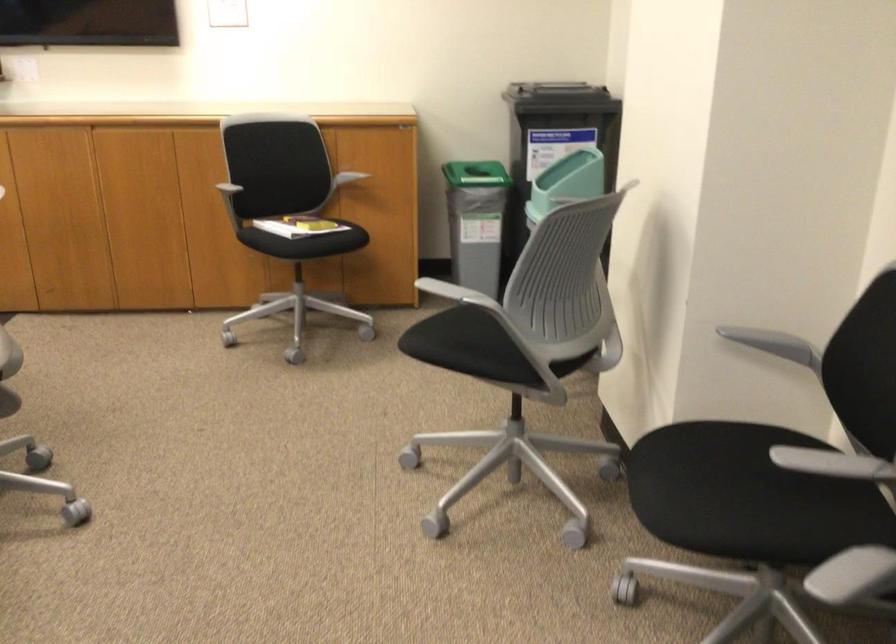
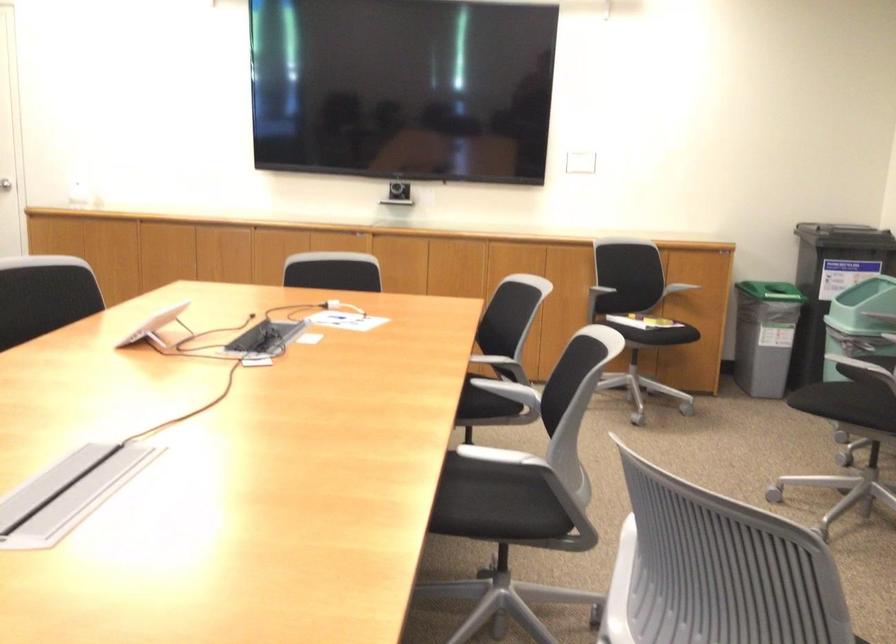
Where in the second image is the point corresponding to the point at 211,211 from the first image?

(571, 290)